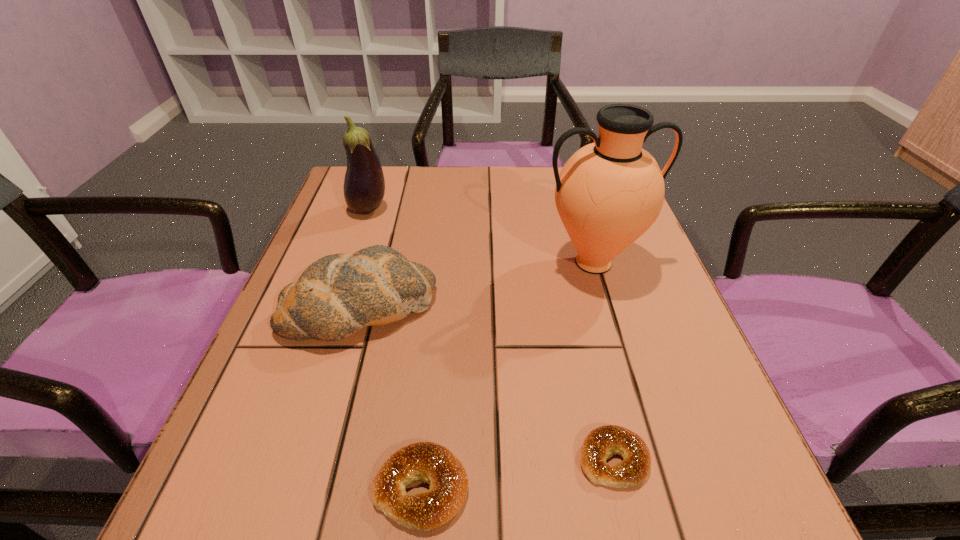
This screenshot has width=960, height=540. Find the location of `unoccupied area between the farthest object and the right bagel`. unoccupied area between the farthest object and the right bagel is located at coordinates (491, 334).

Identify the location of free space between the shorter bagel and the pitcher. (604, 361).

Locate an element on the screen. The height and width of the screenshot is (540, 960). vacant area that lies between the third shortest object and the left bagel is located at coordinates (391, 397).

You are a GUI agent. You are given a task and a screenshot of the screen. Output one action in this format:
    pyautogui.click(x=<x>, y=<y>)
    Task: Click on the free space that is in between the pitcher and the eggplant
    The image size is (960, 540).
    Given the screenshot: What is the action you would take?
    pyautogui.click(x=481, y=236)

Identify which object is located as the third nearest to the shortest object. Please provide its 2D coordinates. Your answer should be formatted as a tuple, i.e. [(x, y)], where the tuple contains the x and y coordinates of a point satisfying the conditions above.

[(610, 192)]

Locate an element on the screen. This screenshot has height=540, width=960. object identified as the second closest to the farthest object is located at coordinates (610, 192).

The width and height of the screenshot is (960, 540). I want to click on blank space that satisfies the following two spatial constraints: 1. on the front side of the second tallest object; 2. on the right side of the third shortest object, so click(x=335, y=307).

This screenshot has height=540, width=960. What are the coordinates of `free space that satisfies the following two spatial constraints: 1. on the front side of the bread; 2. on the right side of the eggplant` in the screenshot? It's located at (335, 307).